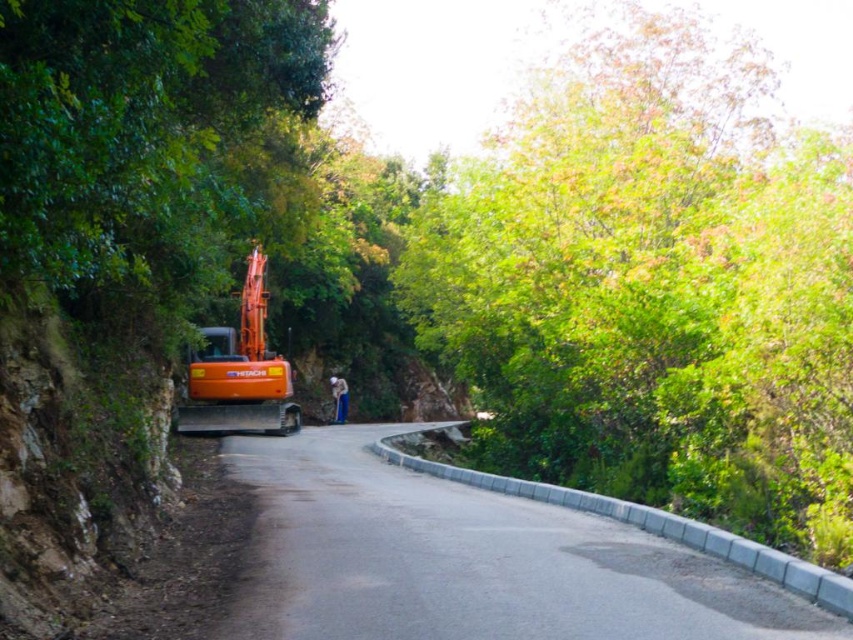
You are a delivery driver approaching the rural road scene. You need to pass by the green leafy tree at upper center and the asphalt road at center. Which object will you encounter first as you drive forward?

You will encounter the green leafy tree at upper center first because it is closer to you than the asphalt road at center, which is further away.

You are a delivery truck driver who needs to pass through the area between the green leafy tree at upper center and the asphalt road at center. Can your truck, which is 2 meters wide, fit through this space?

The green leafy tree at upper center is wider than the asphalt road at center. Since the truck is 2 meters wide, it depends on the actual width of the asphalt road. However, without specific measurements, it is uncertain if the truck can fit through the space between them.

You are a delivery driver approaching the asphalt road at center and see the orange metallic excavator at left parked on the road. From your perspective, is the excavator higher or lower than the road surface?

The asphalt road at center is below orange metallic excavator at left, so the excavator is higher than the road surface.